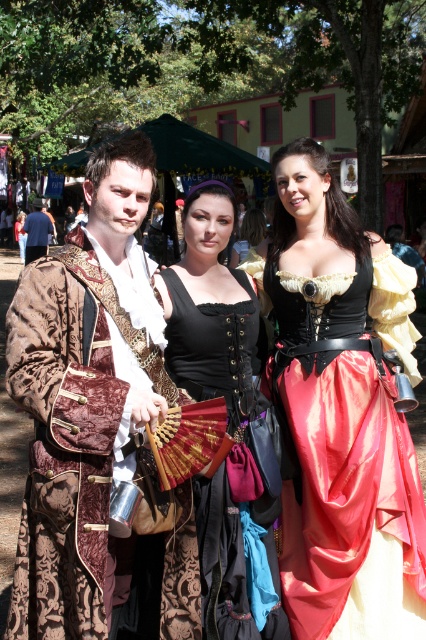
You are a photographer at the Renaissance fair and want to position the velvet brown coat at center and the matte black jacket at center in your shot. According to the scene, which object is positioned to the right of the other?

The velvet brown coat at center is to the right of the matte black jacket at center.

You are standing at the edge of the Renaissance fair grounds and want to locate the black velvet dress at center. Based on the coordinates provided, in which direction should you look to find it?

The black velvet dress at center is located at coordinates point (x=227, y=420), so you should look towards the center of the image slightly to the right.